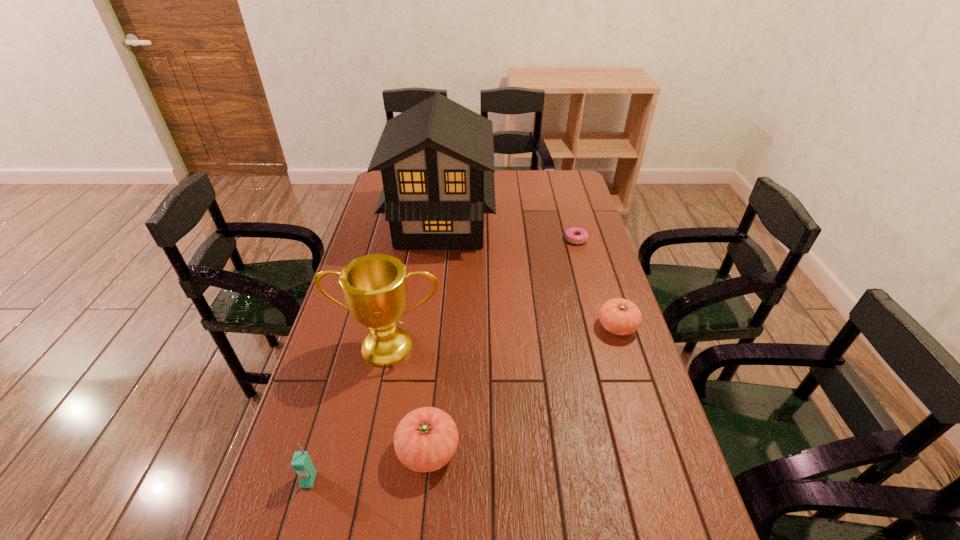
Identify the location of the left tomato. This screenshot has height=540, width=960. (425, 440).

The width and height of the screenshot is (960, 540). Identify the location of the nearer tomato. (425, 440).

The width and height of the screenshot is (960, 540). What are the coordinates of `the right tomato` in the screenshot? It's located at (619, 316).

Identify the location of the farther tomato. (619, 316).

This screenshot has width=960, height=540. What are the coordinates of `dollhouse` in the screenshot? It's located at (436, 159).

This screenshot has height=540, width=960. Find the location of `the shortest object`. the shortest object is located at coordinates (575, 235).

The height and width of the screenshot is (540, 960). I want to click on the second tallest object, so click(374, 287).

Identify the location of the fourth shortest object. (301, 463).

Locate an element on the screen. This screenshot has width=960, height=540. vacant point located on the back of the nearer tomato is located at coordinates (438, 346).

You are a GUI agent. You are given a task and a screenshot of the screen. Output one action in this format:
    pyautogui.click(x=<x>, y=<y>)
    Task: Click on the free space located 0.160m on the back of the right tomato
    The height and width of the screenshot is (540, 960).
    Given the screenshot: What is the action you would take?
    pyautogui.click(x=602, y=279)